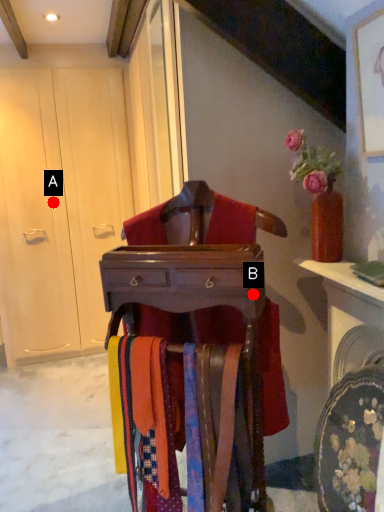
Question: Two points are circled on the image, labeled by A and B beside each circle. Which point appears closest to the camera in this image?

Choices:
 (A) A is closer
 (B) B is closer

Answer: (B)